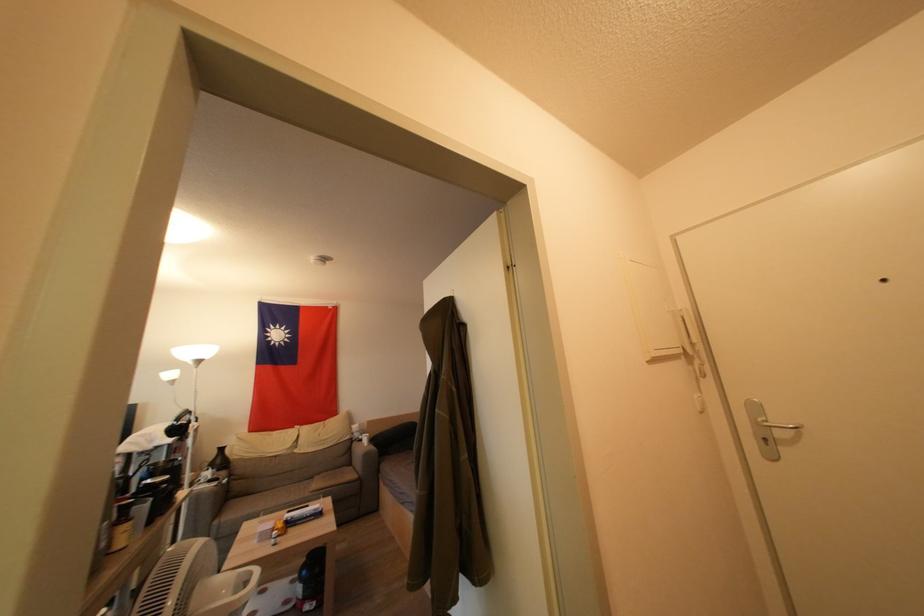
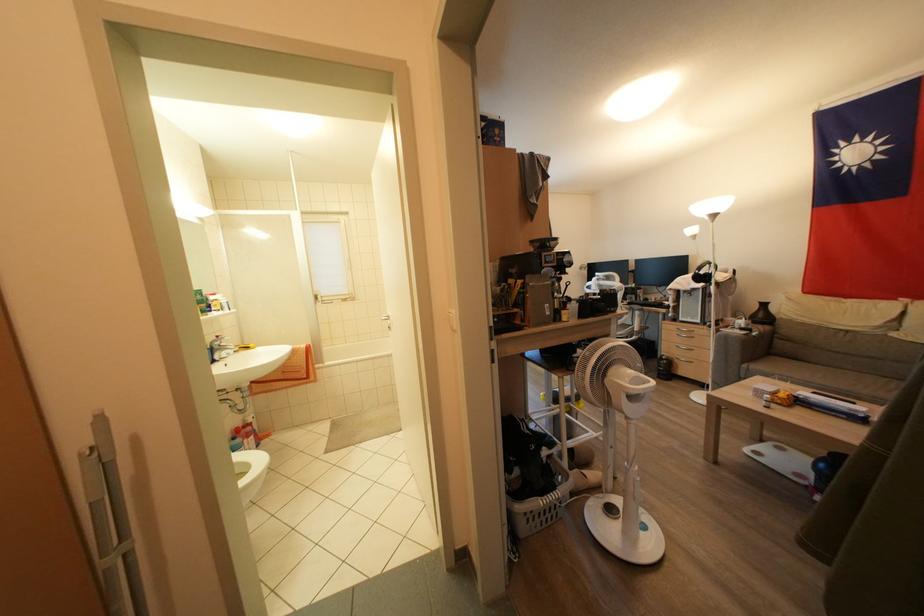
In the second image, find the point that corresponds to [215,485] in the first image.

(747, 333)